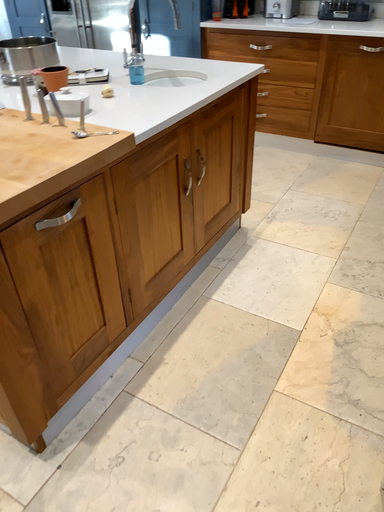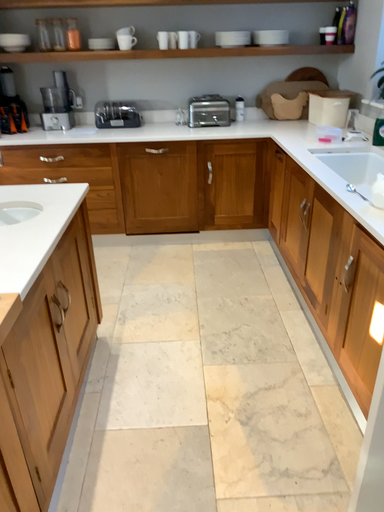
Question: Which way did the camera rotate in the video?

Choices:
 (A) rotated downward
 (B) rotated upward

Answer: (B)